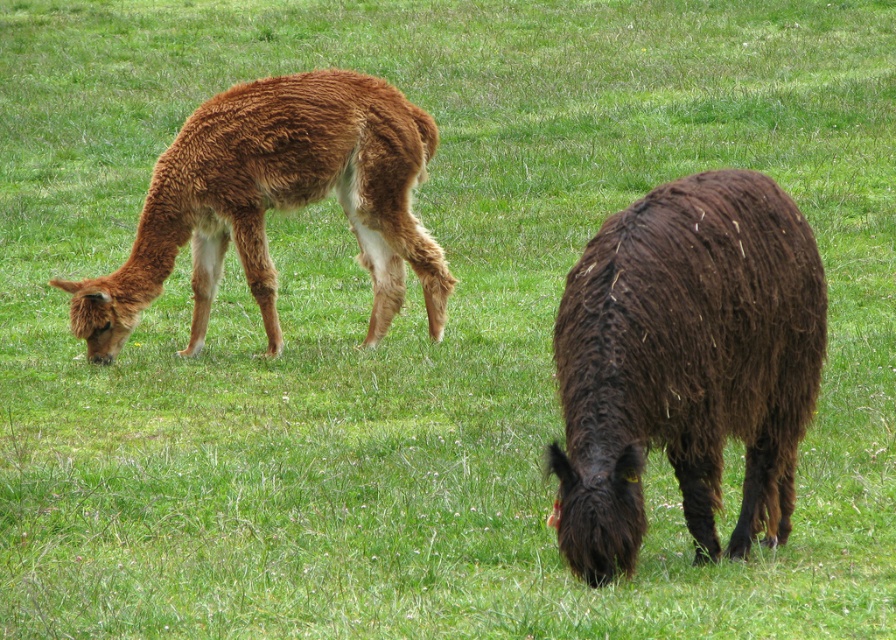
Question: Is dark brown woolly alpaca at right further to the viewer compared to brown woolly alpaca at left?

Choices:
 (A) no
 (B) yes

Answer: (A)

Question: Which object appears closest to the camera in this image?

Choices:
 (A) brown woolly alpaca at left
 (B) dark brown woolly alpaca at right

Answer: (B)

Question: Is dark brown woolly alpaca at right below brown woolly alpaca at left?

Choices:
 (A) no
 (B) yes

Answer: (B)

Question: Among these points, which one is nearest to the camera?

Choices:
 (A) (694, 216)
 (B) (205, 260)

Answer: (A)

Question: Does dark brown woolly alpaca at right come in front of brown woolly alpaca at left?

Choices:
 (A) yes
 (B) no

Answer: (A)

Question: Which point is closer to the camera taking this photo?

Choices:
 (A) (647, 445)
 (B) (252, 106)

Answer: (A)